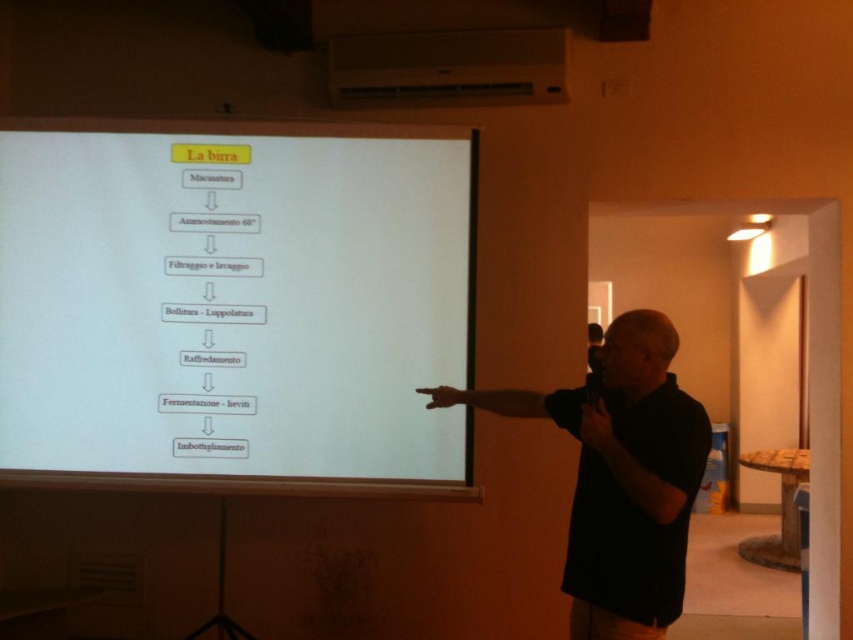
Question: Can you confirm if white paper at center is positioned below black matte shirt at center?

Choices:
 (A) yes
 (B) no

Answer: (B)

Question: Which object appears farthest from the camera in this image?

Choices:
 (A) black matte shirt at center
 (B) white plastic projector at upper center
 (C) white paper at center

Answer: (B)

Question: Estimate the real-world distances between objects in this image. Which object is farther from the black matte shirt at center?

Choices:
 (A) white plastic projector at upper center
 (B) white paper at center

Answer: (A)

Question: Is black matte shirt at center smaller than white plastic projector at upper center?

Choices:
 (A) yes
 (B) no

Answer: (B)

Question: Is black matte shirt at center bigger than white plastic projector at upper center?

Choices:
 (A) yes
 (B) no

Answer: (A)

Question: Estimate the real-world distances between objects in this image. Which object is closer to the black matte shirt at center?

Choices:
 (A) white plastic projector at upper center
 (B) white paper at center

Answer: (B)